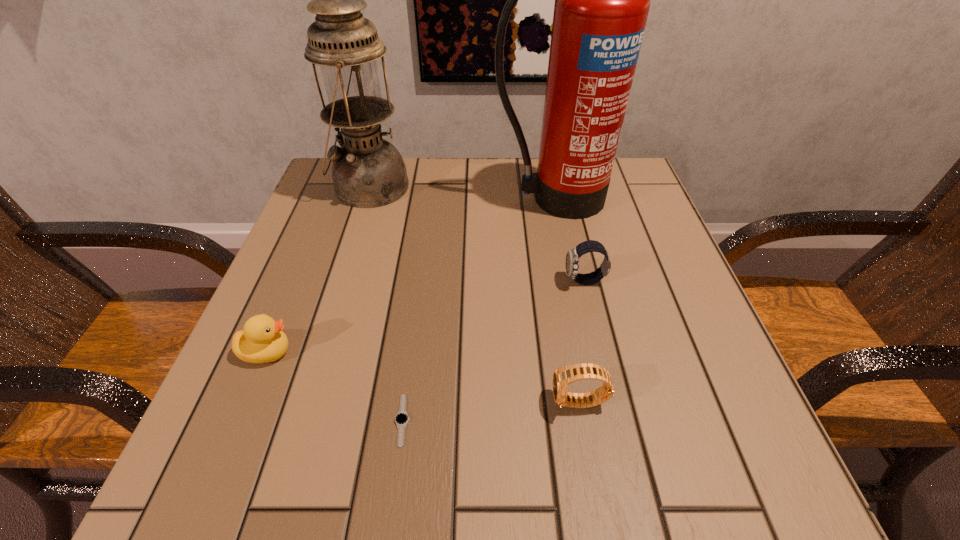
Identify the location of the tallest object. (602, 0).

At what (x,y) coordinates should I click in order to perform the action: click on the second tallest object. Please return your answer as a coordinate pair (x, y). Looking at the image, I should click on (368, 172).

Where is `the third farthest object`? The width and height of the screenshot is (960, 540). the third farthest object is located at coordinates (572, 258).

Where is `the fourth farthest object`? The width and height of the screenshot is (960, 540). the fourth farthest object is located at coordinates (262, 340).

Locate an element on the screen. the shortest watch is located at coordinates (401, 419).

At what (x,y) coordinates should I click in order to perform the action: click on the shortest object. Please return your answer as a coordinate pair (x, y). Looking at the image, I should click on (401, 419).

I want to click on vacant space situated on the surface of the fire extinguisher, so click(x=570, y=281).

At what (x,y) coordinates should I click in order to perform the action: click on free space located on the right of the second tallest object. Please return your answer as a coordinate pair (x, y). This screenshot has height=540, width=960. Looking at the image, I should click on pos(571,187).

Identify the location of blank area located 0.060m on the face of the third farthest object. (533, 281).

In order to click on free space located 0.110m on the face of the third farthest object in this screenshot , I will do `click(506, 281)`.